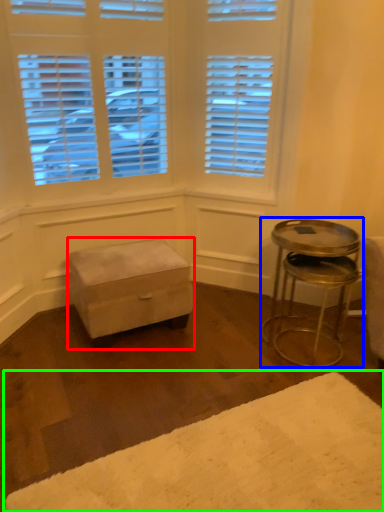
Question: Based on their relative distances, which object is farther from stool (highlighted by a red box)? Choose from table (highlighted by a blue box) and plain (highlighted by a green box).

Choices:
 (A) table
 (B) plain

Answer: (B)